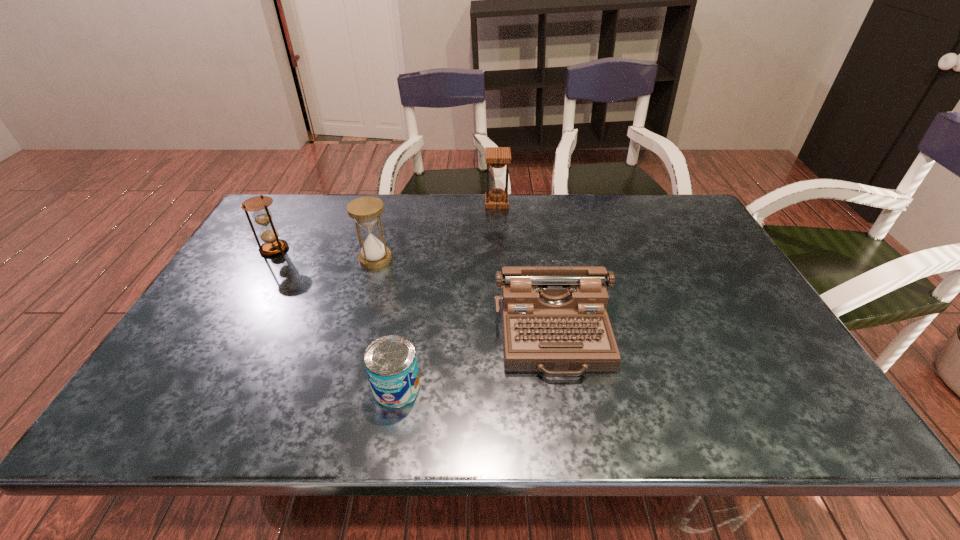
This screenshot has width=960, height=540. In order to click on vacant area that lies between the fourth tallest object and the leftmost object in this screenshot , I will do `click(414, 292)`.

Locate an element on the screen. free space between the second shortest object and the fourth object from right to left is located at coordinates [x=465, y=297].

Where is `unoccupied area between the leftmost hourglass and the second object from left to right`? The height and width of the screenshot is (540, 960). unoccupied area between the leftmost hourglass and the second object from left to right is located at coordinates (324, 254).

Identify the location of empty space that is in between the fourth object from right to left and the shortest object. This screenshot has width=960, height=540. (386, 323).

Find the location of a particular element. This screenshot has height=540, width=960. vacant region between the leftmost hourglass and the farthest object is located at coordinates (385, 226).

Find the location of a particular element. empty location between the shortest object and the second hourglass from right to left is located at coordinates (386, 323).

Find the location of a particular element. Image resolution: width=960 pixels, height=540 pixels. empty space between the second object from left to right and the farthest hourglass is located at coordinates (436, 231).

What are the coordinates of `vacant area between the farthest hourglass and the can` in the screenshot? It's located at (446, 295).

Identify the location of object identified as the third closest to the fourth tallest object. (497, 158).

Identify which object is the nearest to the third object from left to right. Please provide its 2D coordinates. Your answer should be formatted as a tuple, i.e. [(x, y)], where the tuple contains the x and y coordinates of a point satisfying the conditions above.

[(554, 320)]